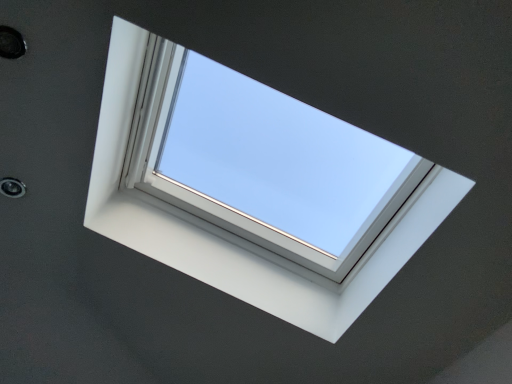
The height and width of the screenshot is (384, 512). I want to click on metallic circular hole at upper left, which is the 1th hole from bottom to top, so [12, 187].

Image resolution: width=512 pixels, height=384 pixels. What do you see at coordinates (237, 234) in the screenshot?
I see `white plastic window at center` at bounding box center [237, 234].

This screenshot has height=384, width=512. What are the coordinates of `white plastic window at center` in the screenshot? It's located at (237, 234).

In order to click on metallic circular hole at upper left, which is counted as the second hole, starting from the back in this screenshot , I will do `click(11, 43)`.

Image resolution: width=512 pixels, height=384 pixels. Find the location of `hole above the white plastic window at center (from the image's perspective)`. hole above the white plastic window at center (from the image's perspective) is located at coordinates (11, 43).

From a real-world perspective, which is physically above, white plastic window at center or metallic circular hole at upper left, arranged as the first hole when viewed from the front?

In real-world perspective, white plastic window at center is above.

Considering the relative sizes of white plastic window at center and metallic circular hole at upper left, which is the first hole from right to left, in the image provided, is white plastic window at center smaller than metallic circular hole at upper left, which is the first hole from right to left,?

No, white plastic window at center is not smaller than metallic circular hole at upper left, which is the first hole from right to left.

Is white plastic window at center far from metallic circular hole at upper left, which is the first hole in top-to-bottom order?

They are positioned close to each other.

Looking at this image, does white plastic window at center have a greater width compared to metallic circular hole at upper left, positioned as the 1th hole in left-to-right order?

Yes.

From the image's perspective, is white plastic window at center below metallic circular hole at upper left, acting as the 2th hole starting from the front?

Incorrect, from the image's perspective, white plastic window at center is higher than metallic circular hole at upper left, acting as the 2th hole starting from the front.

From a real-world perspective, is white plastic window at center above or below metallic circular hole at upper left, which is the second hole in right-to-left order?

white plastic window at center is above metallic circular hole at upper left, which is the second hole in right-to-left order.

Considering the positions of objects white plastic window at center and metallic circular hole at upper left, which is counted as the 2th hole, starting from the top, in the image provided, who is more to the left, white plastic window at center or metallic circular hole at upper left, which is counted as the 2th hole, starting from the top,?

Positioned to the left is metallic circular hole at upper left, which is counted as the 2th hole, starting from the top.

Visually, is metallic circular hole at upper left, which is the first hole from right to left, positioned to the left or to the right of metallic circular hole at upper left, which is the second hole in right-to-left order?

metallic circular hole at upper left, which is the first hole from right to left, is positioned on metallic circular hole at upper left, which is the second hole in right-to-left order,'s right side.

Does metallic circular hole at upper left, which is the first hole from right to left, have a smaller size compared to metallic circular hole at upper left, acting as the 2th hole starting from the front?

Incorrect, metallic circular hole at upper left, which is the first hole from right to left, is not smaller in size than metallic circular hole at upper left, acting as the 2th hole starting from the front.

From a real-world perspective, relative to metallic circular hole at upper left, which is the second hole in right-to-left order, is metallic circular hole at upper left, acting as the second hole starting from the bottom, vertically above or below?

From a real-world perspective, metallic circular hole at upper left, acting as the second hole starting from the bottom, is physically above metallic circular hole at upper left, which is the second hole in right-to-left order.

Is metallic circular hole at upper left, which is the first hole in top-to-bottom order, looking in the opposite direction of metallic circular hole at upper left, which is the 1th hole from bottom to top?

Yes, metallic circular hole at upper left, which is the first hole in top-to-bottom order, is facing away from metallic circular hole at upper left, which is the 1th hole from bottom to top.

Is metallic circular hole at upper left, positioned as the 1th hole in left-to-right order, with metallic circular hole at upper left, which is counted as the second hole, starting from the back?

metallic circular hole at upper left, positioned as the 1th hole in left-to-right order, and metallic circular hole at upper left, which is counted as the second hole, starting from the back, are not in contact.

Considering the sizes of metallic circular hole at upper left, which is the second hole in right-to-left order, and metallic circular hole at upper left, acting as the second hole starting from the bottom, in the image, is metallic circular hole at upper left, which is the second hole in right-to-left order, bigger or smaller than metallic circular hole at upper left, acting as the second hole starting from the bottom,?

Considering their sizes, metallic circular hole at upper left, which is the second hole in right-to-left order, takes up less space than metallic circular hole at upper left, acting as the second hole starting from the bottom.

Does metallic circular hole at upper left, positioned as the 1th hole in left-to-right order, lie behind metallic circular hole at upper left, arranged as the first hole when viewed from the front?

Yes, metallic circular hole at upper left, positioned as the 1th hole in left-to-right order, is behind metallic circular hole at upper left, arranged as the first hole when viewed from the front.

Is metallic circular hole at upper left, arranged as the first hole when viewed from the front, at the back of metallic circular hole at upper left, positioned as the 1th hole in left-to-right order?

metallic circular hole at upper left, positioned as the 1th hole in left-to-right order, does not have its back to metallic circular hole at upper left, arranged as the first hole when viewed from the front.

Are metallic circular hole at upper left, which is counted as the 2th hole, starting from the top, and white plastic window at center making contact?

metallic circular hole at upper left, which is counted as the 2th hole, starting from the top, and white plastic window at center are not in contact.

Locate an element on the screen. Image resolution: width=512 pixels, height=384 pixels. window in front of the metallic circular hole at upper left, which is the 1th hole from bottom to top is located at coordinates (237, 234).

Considering the positions of objects metallic circular hole at upper left, acting as the 2th hole starting from the front, and white plastic window at center in the image provided, who is more to the left, metallic circular hole at upper left, acting as the 2th hole starting from the front, or white plastic window at center?

metallic circular hole at upper left, acting as the 2th hole starting from the front.

Can you confirm if metallic circular hole at upper left, acting as the 2th hole starting from the front, is smaller than white plastic window at center?

Yes, metallic circular hole at upper left, acting as the 2th hole starting from the front, is smaller than white plastic window at center.

Do you think metallic circular hole at upper left, arranged as the first hole when viewed from the front, is within white plastic window at center, or outside of it?

metallic circular hole at upper left, arranged as the first hole when viewed from the front, exists outside the volume of white plastic window at center.

From the image's perspective, is metallic circular hole at upper left, which is the first hole in top-to-bottom order, positioned above or below white plastic window at center?

metallic circular hole at upper left, which is the first hole in top-to-bottom order, is above white plastic window at center.

Is metallic circular hole at upper left, arranged as the first hole when viewed from the front, facing away from white plastic window at center?

That's not correct — metallic circular hole at upper left, arranged as the first hole when viewed from the front, is not looking away from white plastic window at center.

Does metallic circular hole at upper left, which is the first hole in top-to-bottom order, have a larger size compared to white plastic window at center?

No.

You are a GUI agent. You are given a task and a screenshot of the screen. Output one action in this format:
    pyautogui.click(x=<x>, y=<y>)
    Task: Click on the window below the metallic circular hole at upper left, which is the first hole in top-to-bottom order (from the image's perspective)
    The image size is (512, 384).
    Given the screenshot: What is the action you would take?
    pyautogui.click(x=237, y=234)

The width and height of the screenshot is (512, 384). Find the location of `window above the metallic circular hole at upper left, which is the 1th hole from bottom to top (from a real-world perspective)`. window above the metallic circular hole at upper left, which is the 1th hole from bottom to top (from a real-world perspective) is located at coordinates (237, 234).

Considering their positions, is metallic circular hole at upper left, acting as the 2th hole starting from the front, positioned closer to white plastic window at center than metallic circular hole at upper left, which is the second hole from left to right?

metallic circular hole at upper left, acting as the 2th hole starting from the front, is closer to white plastic window at center.

Considering their positions, is metallic circular hole at upper left, which is the first hole from right to left, positioned further to metallic circular hole at upper left, which is the second hole in right-to-left order, than white plastic window at center?

white plastic window at center lies further to metallic circular hole at upper left, which is the second hole in right-to-left order, than the other object.

Based on their spatial positions, is metallic circular hole at upper left, acting as the 2th hole starting from the front, or white plastic window at center further from metallic circular hole at upper left, which is the first hole in top-to-bottom order?

Among the two, white plastic window at center is located further to metallic circular hole at upper left, which is the first hole in top-to-bottom order.

Based on the photo, estimate the real-world distances between objects in this image. Which object is closer to white plastic window at center, metallic circular hole at upper left, which is the first hole in top-to-bottom order, or metallic circular hole at upper left, which is the 1th hole from bottom to top?

metallic circular hole at upper left, which is the 1th hole from bottom to top, is positioned closer to the anchor white plastic window at center.

Looking at the image, which one is located closer to metallic circular hole at upper left, which is the first hole from right to left, white plastic window at center or metallic circular hole at upper left, acting as the 2th hole starting from the front?

metallic circular hole at upper left, acting as the 2th hole starting from the front, is positioned closer to the anchor metallic circular hole at upper left, which is the first hole from right to left.

Which object lies nearer to the anchor point metallic circular hole at upper left, which is the second hole in right-to-left order, white plastic window at center or metallic circular hole at upper left, which is counted as the second hole, starting from the back?

Among the two, metallic circular hole at upper left, which is counted as the second hole, starting from the back, is located nearer to metallic circular hole at upper left, which is the second hole in right-to-left order.

Locate an element on the screen. hole between metallic circular hole at upper left, which is the 1th hole from bottom to top, and white plastic window at center from left to right is located at coordinates (11, 43).